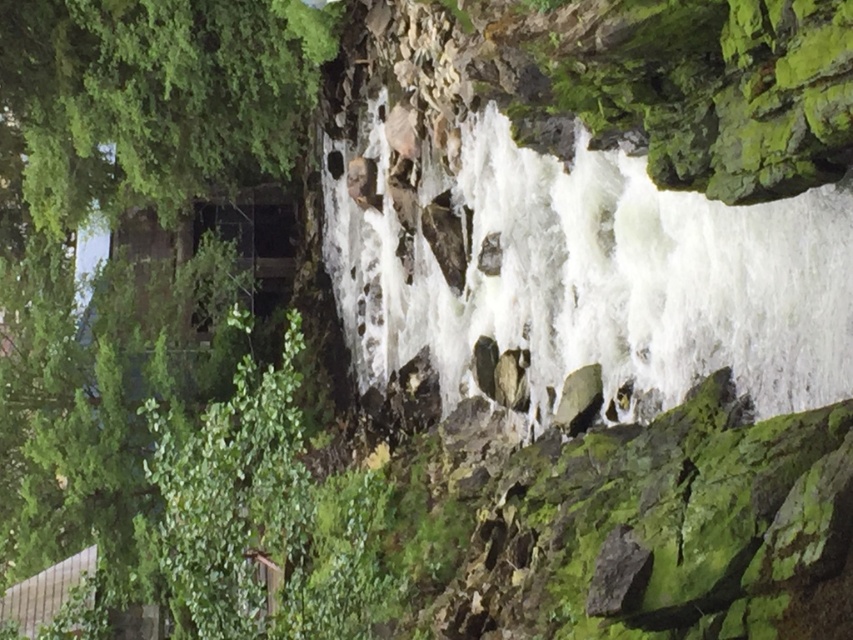
You are standing at the base of the waterfall and want to reach the point marked as point (474,244). If your walking speed is 1.5 meters per second, how long will it take you to reach that point?

The point (474,244) is 15.92 meters from the viewer. At a walking speed of 1.5 meters per second, it will take approximately 10.6 seconds to reach the point.

In the scene shown: You are a hiker who wants to take a photo of the white frothy water at center and the green leafy tree at left. Since you have a camera with a fixed focal length, you need to adjust your position to frame both objects in the shot. Considering their sizes in the image, which object should you focus on first to ensure both are in the frame?

The white frothy water at center is much taller than the green leafy tree at left, so you should focus on the white frothy water at center first to ensure it fits within the frame before adjusting for the smaller green leafy tree at left.

You are standing at the edge of the cliff overlooking the waterfall. You see the white frothy water at center and the green leafy tree at left. Which object is nearer to you?

The white frothy water at center is closer to the viewer than the green leafy tree at left, so the white frothy water at center is nearer to you.